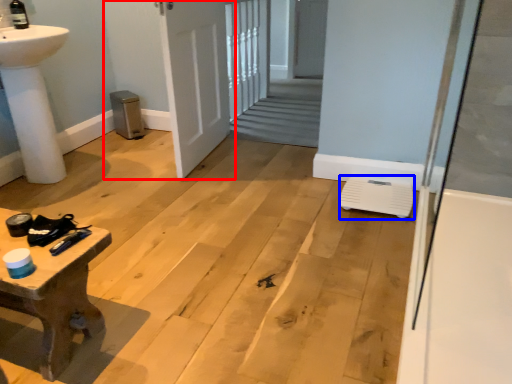
Question: Which point is further to the camera, door (highlighted by a red box) or water heater (highlighted by a blue box)?

Choices:
 (A) door
 (B) water heater

Answer: (A)